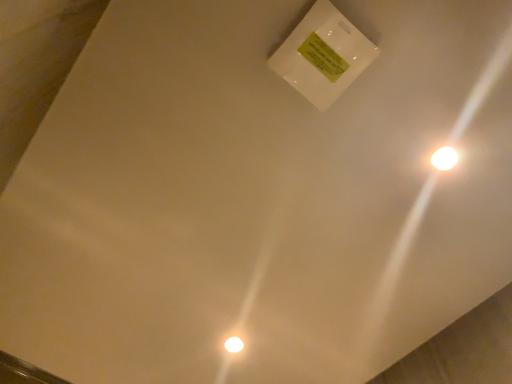
Where is `free space in front of white glossy light bulb at lower center`? This screenshot has width=512, height=384. free space in front of white glossy light bulb at lower center is located at coordinates (223, 300).